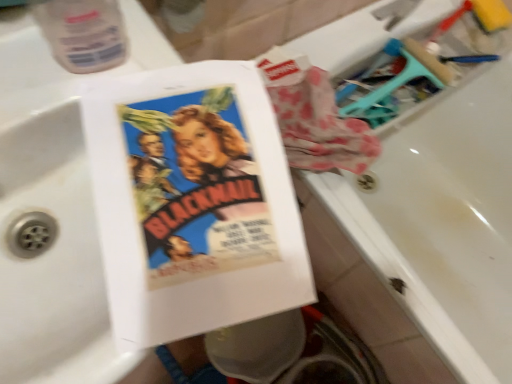
Question: Considering the relative positions of white glossy bathtub at upper right and transparent plastic bottle at upper left in the image provided, is white glossy bathtub at upper right to the right of transparent plastic bottle at upper left from the viewer's perspective?

Choices:
 (A) yes
 (B) no

Answer: (A)

Question: Does white glossy bathtub at upper right have a greater width compared to transparent plastic bottle at upper left?

Choices:
 (A) no
 (B) yes

Answer: (B)

Question: Is white glossy bathtub at upper right shorter than transparent plastic bottle at upper left?

Choices:
 (A) no
 (B) yes

Answer: (A)

Question: Considering the relative positions of white glossy bathtub at upper right and transparent plastic bottle at upper left in the image provided, is white glossy bathtub at upper right to the left of transparent plastic bottle at upper left from the viewer's perspective?

Choices:
 (A) yes
 (B) no

Answer: (B)

Question: Is transparent plastic bottle at upper left a part of white glossy bathtub at upper right?

Choices:
 (A) yes
 (B) no

Answer: (B)

Question: Is point pos(423,261) closer or farther from the camera than point pos(226,173)?

Choices:
 (A) closer
 (B) farther

Answer: (B)

Question: From a real-world perspective, is white glossy bathtub at upper right positioned above or below matte paper book at center?

Choices:
 (A) below
 (B) above

Answer: (A)

Question: Would you say white glossy bathtub at upper right is inside or outside matte paper book at center?

Choices:
 (A) outside
 (B) inside

Answer: (A)

Question: Considering the positions of white glossy bathtub at upper right and matte paper book at center in the image, is white glossy bathtub at upper right taller or shorter than matte paper book at center?

Choices:
 (A) tall
 (B) short

Answer: (A)

Question: Is transparent plastic bottle at upper left taller or shorter than white glossy bathtub at upper right?

Choices:
 (A) tall
 (B) short

Answer: (B)

Question: Considering the positions of transparent plastic bottle at upper left and white glossy bathtub at upper right in the image, is transparent plastic bottle at upper left bigger or smaller than white glossy bathtub at upper right?

Choices:
 (A) small
 (B) big

Answer: (A)

Question: From a real-world perspective, relative to white glossy bathtub at upper right, is transparent plastic bottle at upper left vertically above or below?

Choices:
 (A) above
 (B) below

Answer: (A)

Question: Is point (34, 16) positioned closer to the camera than point (429, 144)?

Choices:
 (A) closer
 (B) farther

Answer: (A)

Question: Is matte paper book at center spatially inside white glossy bathtub at upper right, or outside of it?

Choices:
 (A) outside
 (B) inside

Answer: (A)

Question: Is point (145, 190) positioned closer to the camera than point (459, 281)?

Choices:
 (A) farther
 (B) closer

Answer: (B)